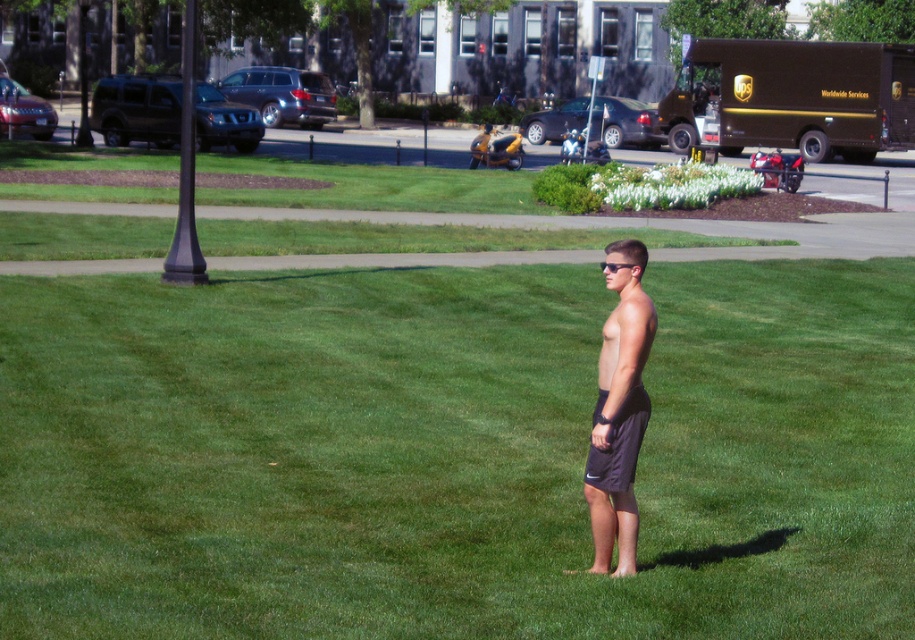
You are standing at the point marked as point (595, 490) in the park. You want to walk straight ahead to the nearest paved pathway. How far will you have to walk?

The distance between you and the paved pathway is 10.40 meters, so you will have to walk 10.40 meters straight ahead to reach it.

You are a photographer taking a picture of two pairs of shorts in a park scene. The scene includes a young man wearing dark gray shorts at center and black fabric shorts at center. Which pair of shorts is bigger in size?

The dark gray shorts at center is larger in size than the black fabric shorts at center.